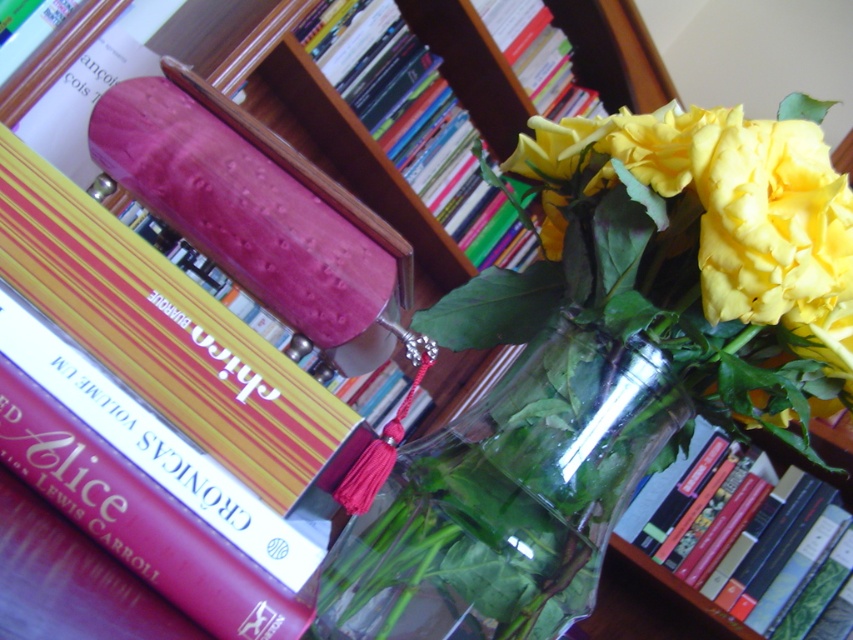
Question: Which object appears closest to the camera in this image?

Choices:
 (A) transparent glass vase at center
 (B) hardcover book at upper center
 (C) matte purple book at upper center

Answer: (A)

Question: Which point appears closest to the camera in this image?

Choices:
 (A) (575, 560)
 (B) (737, 632)

Answer: (A)

Question: Does matte purple book at upper center come in front of hardcover book at upper center?

Choices:
 (A) no
 (B) yes

Answer: (A)

Question: Does transparent glass vase at center have a larger size compared to hardcover book at upper center?

Choices:
 (A) no
 (B) yes

Answer: (A)

Question: Does matte purple book at upper center appear on the right side of hardcover book at upper center?

Choices:
 (A) no
 (B) yes

Answer: (A)

Question: Which object appears farthest from the camera in this image?

Choices:
 (A) hardcover book at upper center
 (B) matte purple book at upper center

Answer: (B)